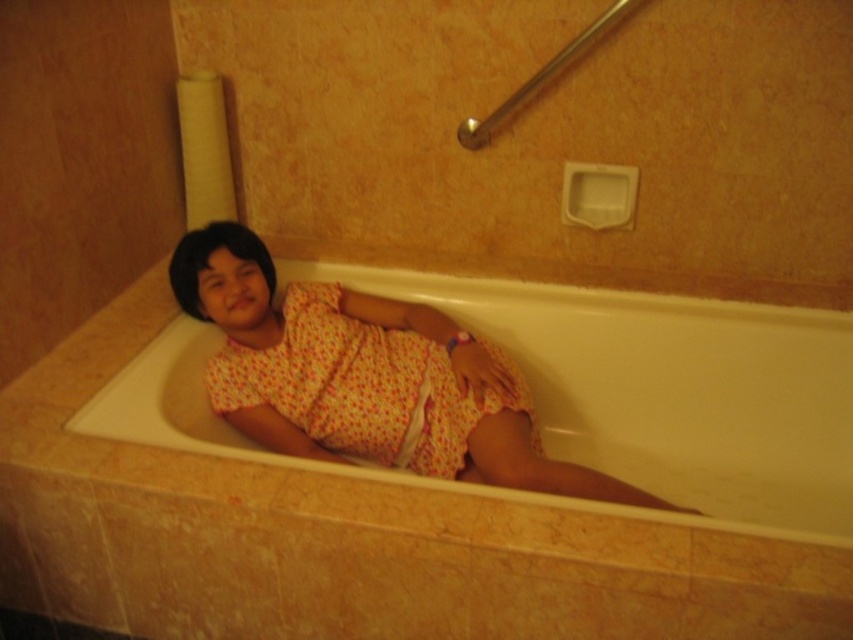
Question: Observing the image, what is the correct spatial positioning of floral fabric dress at center in reference to floral cotton dress at center?

Choices:
 (A) left
 (B) right

Answer: (B)

Question: Observing the image, what is the correct spatial positioning of floral fabric dress at center in reference to floral cotton dress at center?

Choices:
 (A) below
 (B) above

Answer: (A)

Question: Which point is farther to the camera?

Choices:
 (A) floral fabric dress at center
 (B) floral cotton dress at center

Answer: (B)

Question: Can you confirm if floral fabric dress at center is wider than floral cotton dress at center?

Choices:
 (A) no
 (B) yes

Answer: (B)

Question: Which point is farther to the camera?

Choices:
 (A) (300, 336)
 (B) (630, 502)

Answer: (A)